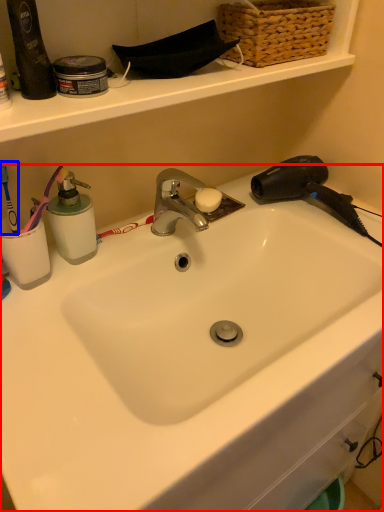
Question: Which of the following is the farthest to the observer, sink (highlighted by a red box) or brush (highlighted by a blue box)?

Choices:
 (A) sink
 (B) brush

Answer: (B)